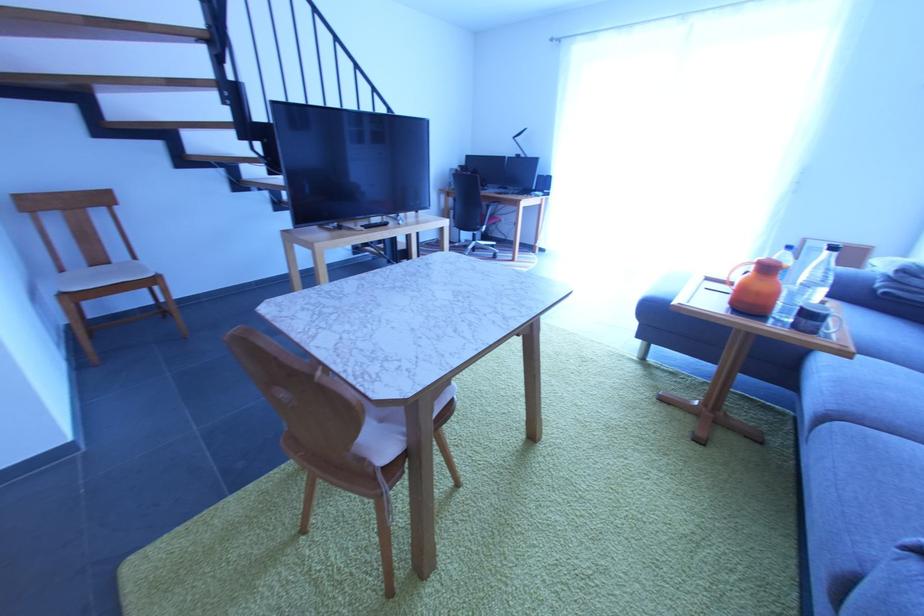
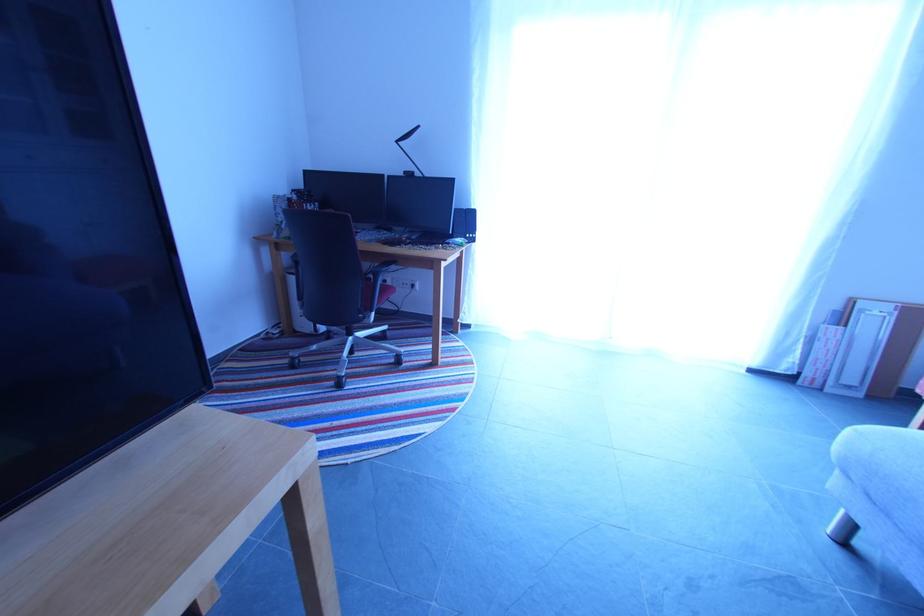
Question: Which direction would the cameraman need to move to produce the second image? Reply with the corresponding letter.

Choices:
 (A) Left
 (B) Right
 (C) Forward
 (D) Backward

Answer: (C)